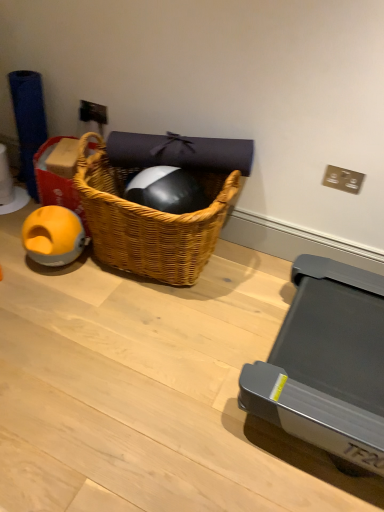
Question: Is orange rubber ball at left shorter than metallic silver power outlet at upper center?

Choices:
 (A) no
 (B) yes

Answer: (A)

Question: From the image's perspective, would you say orange rubber ball at left is positioned over metallic silver power outlet at upper center?

Choices:
 (A) no
 (B) yes

Answer: (A)

Question: Is orange rubber ball at left outside metallic silver power outlet at upper center?

Choices:
 (A) no
 (B) yes

Answer: (B)

Question: Can metallic silver power outlet at upper center be found inside orange rubber ball at left?

Choices:
 (A) no
 (B) yes

Answer: (A)

Question: Does orange rubber ball at left lie in front of metallic silver power outlet at upper center?

Choices:
 (A) yes
 (B) no

Answer: (A)

Question: From a real-world perspective, is orange rubber ball at left below metallic silver power outlet at upper center?

Choices:
 (A) no
 (B) yes

Answer: (B)

Question: Is yellow rubber ball at left surrounding metallic silver power outlet at upper center?

Choices:
 (A) no
 (B) yes

Answer: (A)

Question: Is yellow rubber ball at left positioned before metallic silver power outlet at upper center?

Choices:
 (A) yes
 (B) no

Answer: (A)

Question: From the image's perspective, is yellow rubber ball at left located beneath metallic silver power outlet at upper center?

Choices:
 (A) no
 (B) yes

Answer: (B)

Question: Are yellow rubber ball at left and metallic silver power outlet at upper center beside each other?

Choices:
 (A) no
 (B) yes

Answer: (A)

Question: Considering the relative sizes of yellow rubber ball at left and metallic silver power outlet at upper center in the image provided, is yellow rubber ball at left bigger than metallic silver power outlet at upper center?

Choices:
 (A) no
 (B) yes

Answer: (B)

Question: Is yellow rubber ball at left located outside metallic silver power outlet at upper center?

Choices:
 (A) yes
 (B) no

Answer: (A)

Question: Does yellow rubber ball at left have a smaller size compared to orange rubber ball at left?

Choices:
 (A) no
 (B) yes

Answer: (A)